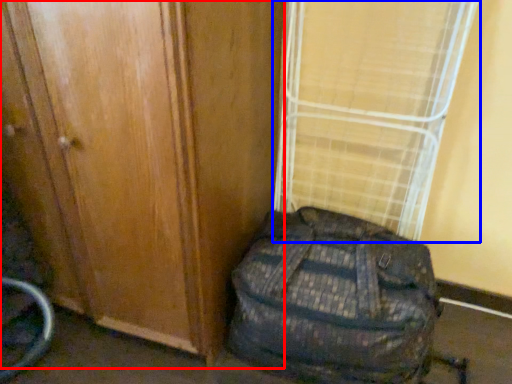
Question: Which object is closer to the camera taking this photo, door (highlighted by a red box) or curtain (highlighted by a blue box)?

Choices:
 (A) door
 (B) curtain

Answer: (A)